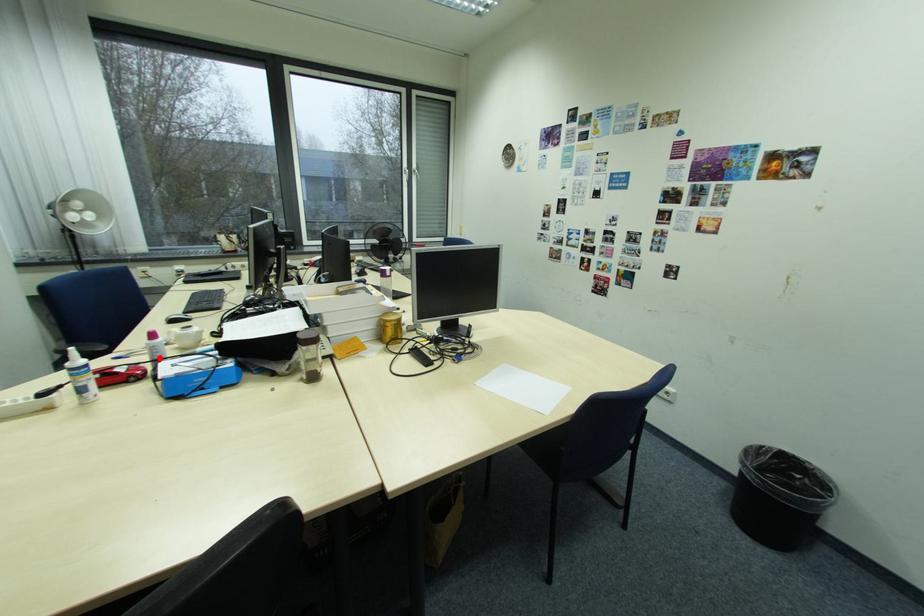
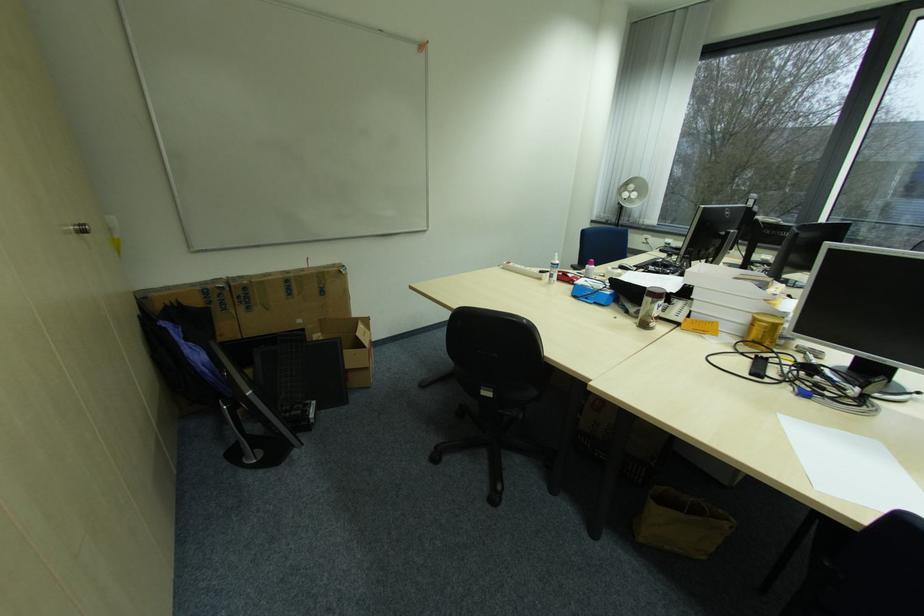
The point at the highlighted location is marked in the first image. Where is the corresponding point in the second image?

(592, 276)